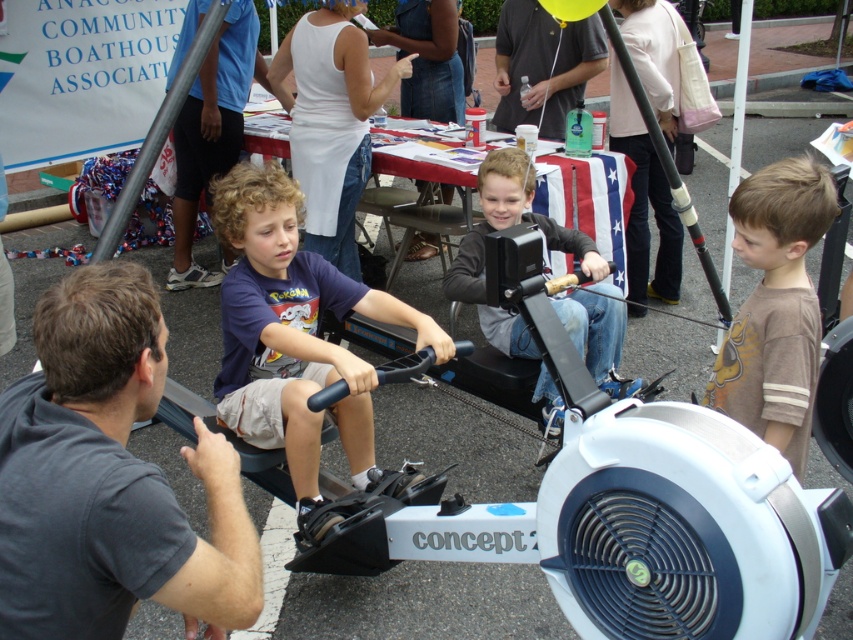
Measure the distance from matte black rowing machine at center to dark blue shirt at center.

2.27 meters

Where is `matte black rowing machine at center`? matte black rowing machine at center is located at coordinates (506, 227).

Locate an element on the screen. matte black rowing machine at center is located at coordinates 506,227.

Does dark blue cotton shirt at center come behind dark blue shirt at center?

No, dark blue cotton shirt at center is closer to the viewer.

Which of these two, dark blue cotton shirt at center or dark blue shirt at center, stands shorter?

dark blue cotton shirt at center is shorter.

Where is `dark blue cotton shirt at center`? The image size is (853, 640). dark blue cotton shirt at center is located at coordinates (294, 337).

Is dark gray shirt at center taller than matte black rowing machine at center?

Incorrect, dark gray shirt at center's height is not larger of matte black rowing machine at center's.

Describe the element at coordinates (108, 477) in the screenshot. I see `dark gray shirt at center` at that location.

Is point (71, 582) farther from viewer compared to point (489, 214)?

No, (71, 582) is closer to viewer.

The width and height of the screenshot is (853, 640). In order to click on dark gray shirt at center in this screenshot , I will do `click(108, 477)`.